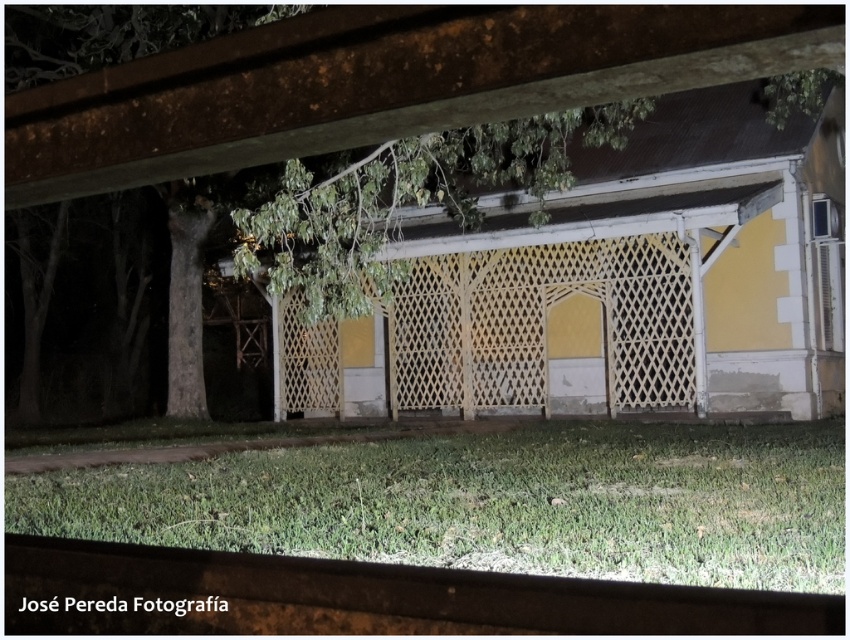
Can you confirm if green grass at lower center is taller than yellow lattice fence at center?

In fact, green grass at lower center may be shorter than yellow lattice fence at center.

Identify the location of green grass at lower center. The image size is (850, 640). (491, 502).

I want to click on green grass at lower center, so [491, 502].

Does green grass at lower center appear on the left side of white lattice fence at center?

Incorrect, green grass at lower center is not on the left side of white lattice fence at center.

Is green grass at lower center taller than white lattice fence at center?

In fact, green grass at lower center may be shorter than white lattice fence at center.

Who is more distant from viewer, (556,531) or (520,246)?

The point (520,246) is more distant.

Locate an element on the screen. Image resolution: width=850 pixels, height=640 pixels. green grass at lower center is located at coordinates (491, 502).

Is green grass at lower center below green leafy tree at center?

Yes.

I want to click on green grass at lower center, so click(x=491, y=502).

Find the location of a particular element. This screenshot has height=640, width=850. green grass at lower center is located at coordinates (491, 502).